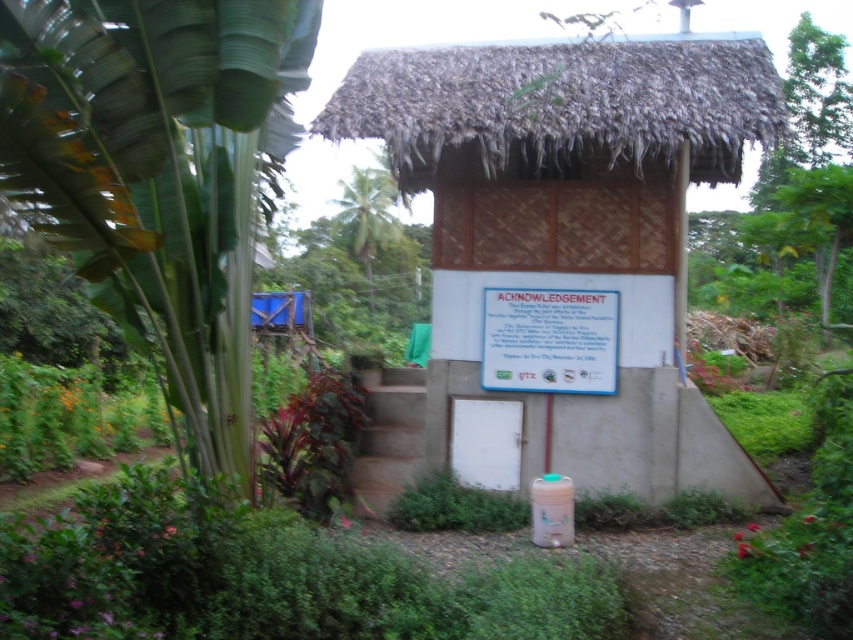
Does thatched roof hut at center appear under white paper at center?

Actually, thatched roof hut at center is above white paper at center.

Can you confirm if thatched roof hut at center is positioned to the right of white paper at center?

Indeed, thatched roof hut at center is positioned on the right side of white paper at center.

This screenshot has width=853, height=640. In order to click on thatched roof hut at center in this screenshot , I will do `click(572, 227)`.

What are the coordinates of `thatched roof hut at center` in the screenshot? It's located at (572, 227).